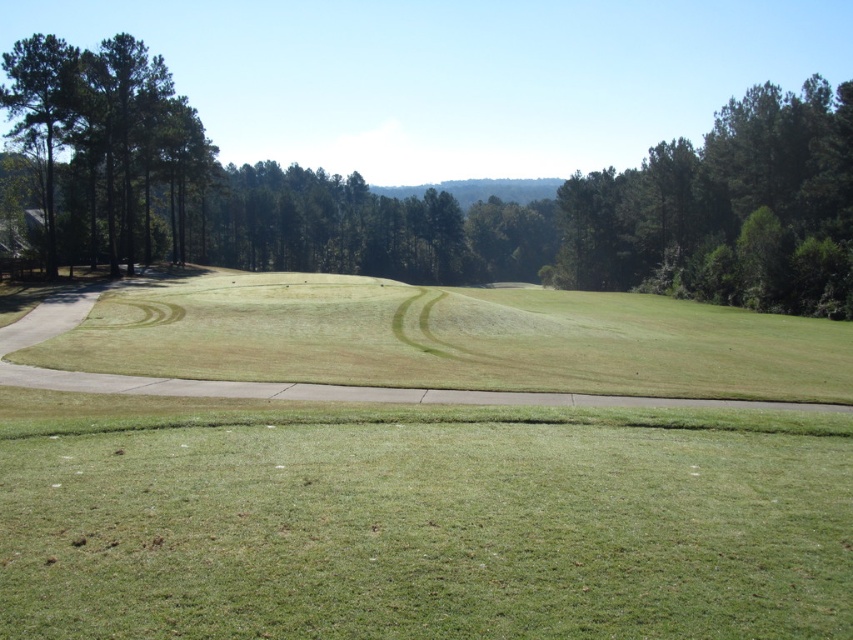
Does green leafy tree at upper right come in front of green textured trees at left?

That is False.

Which is more to the right, green leafy tree at upper right or green textured trees at left?

green leafy tree at upper right is more to the right.

Is point (685, 243) less distant than point (138, 65)?

No.

This screenshot has height=640, width=853. Identify the location of green leafy tree at upper right. (726, 209).

Between green grass at lower center and green textured trees at left, which one has more height?

Standing taller between the two is green textured trees at left.

Can you confirm if green grass at lower center is wider than green textured trees at left?

No.

Who is more distant from viewer, (633, 573) or (119, 259)?

The point (119, 259) is behind.

The image size is (853, 640). Identify the location of green grass at lower center. (425, 524).

Is point (668, 243) farther from camera compared to point (561, 246)?

No.

Does green leafy tree at upper left have a lesser width compared to green leafy tree at upper right?

In fact, green leafy tree at upper left might be wider than green leafy tree at upper right.

At what (x,y) coordinates should I click in order to perform the action: click on green leafy tree at upper left. Please return your answer as a coordinate pair (x, y). This screenshot has height=640, width=853. Looking at the image, I should click on (444, 196).

This screenshot has width=853, height=640. Find the location of `green leafy tree at upper left`. green leafy tree at upper left is located at coordinates (444, 196).